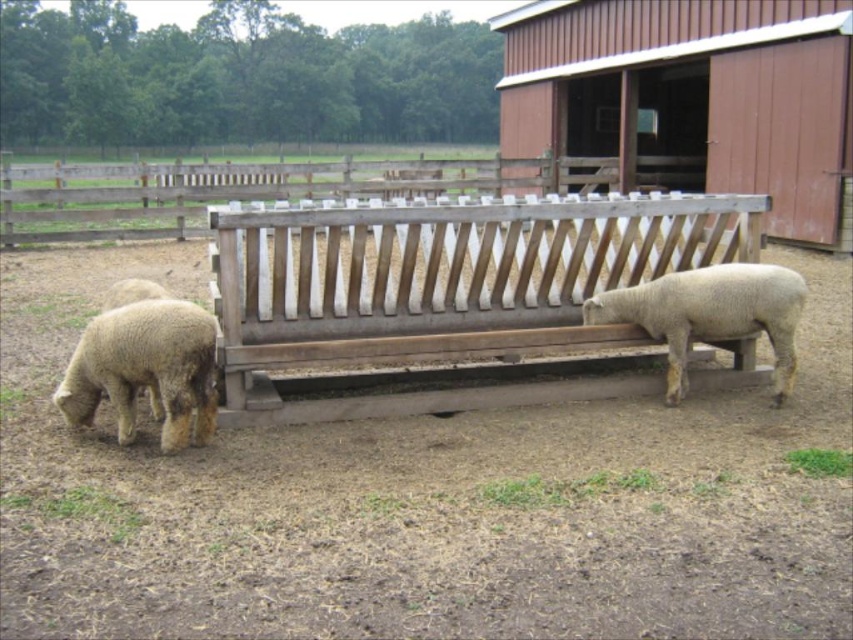
Does brown wooden barn at upper center have a greater height compared to white woolen sheep at lower left?

Indeed, brown wooden barn at upper center has a greater height compared to white woolen sheep at lower left.

The width and height of the screenshot is (853, 640). Find the location of `brown wooden barn at upper center`. brown wooden barn at upper center is located at coordinates (693, 92).

At what (x,y) coordinates should I click in order to perform the action: click on brown wooden barn at upper center. Please return your answer as a coordinate pair (x, y). The width and height of the screenshot is (853, 640). Looking at the image, I should click on (693, 92).

Does point (775, 230) come closer to viewer compared to point (119, 298)?

No, it is behind (119, 298).

Identify the location of brown wooden barn at upper center. (693, 92).

Who is shorter, weathered wood bench at center or green leafy grass at lower right?

Standing shorter between the two is green leafy grass at lower right.

Who is more distant from viewer, (467, 406) or (813, 454)?

Point (467, 406)

Identify the location of weathered wood bench at center. point(439,284).